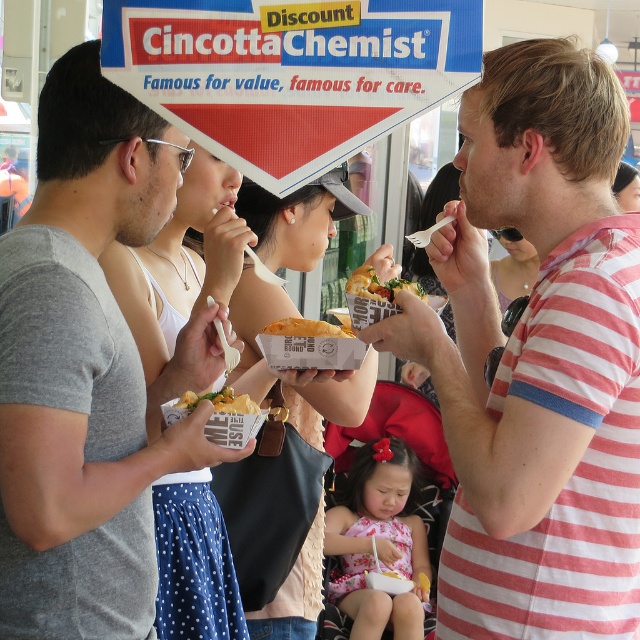
Question: Does striped cotton shirt at right appear over gray matte t-shirt at left?

Choices:
 (A) no
 (B) yes

Answer: (A)

Question: Does gray matte t-shirt at left have a greater width compared to golden crispy bread at center?

Choices:
 (A) yes
 (B) no

Answer: (A)

Question: Estimate the real-world distances between objects in this image. Which object is closer to the golden crispy fries at center?

Choices:
 (A) gray matte t-shirt at left
 (B) golden crispy sandwich at center
 (C) golden crispy bread at center

Answer: (A)

Question: Which point appears closest to the camera in this image?

Choices:
 (A) (440, 616)
 (B) (10, 433)
 (C) (348, 337)
 (D) (362, 285)

Answer: (B)

Question: Does striped cotton shirt at right have a lesser width compared to golden crispy fries at center?

Choices:
 (A) yes
 (B) no

Answer: (B)

Question: Which point is farther to the camera?

Choices:
 (A) golden crispy fries at center
 (B) striped cotton shirt at right
 (C) gray matte t-shirt at left
 (D) golden crispy bread at center

Answer: (D)